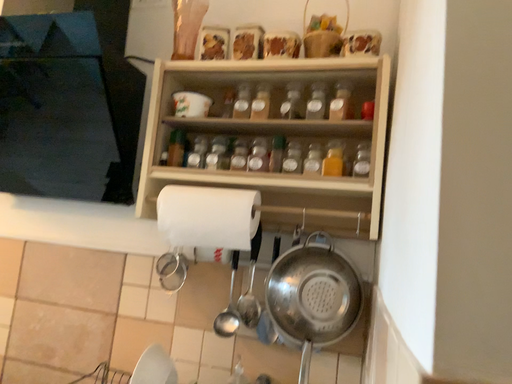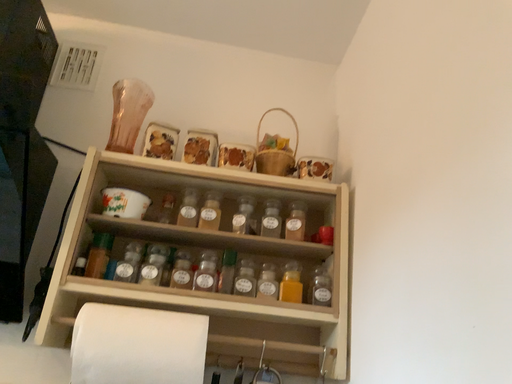
Question: Which way did the camera rotate in the video?

Choices:
 (A) rotated left
 (B) rotated right

Answer: (B)